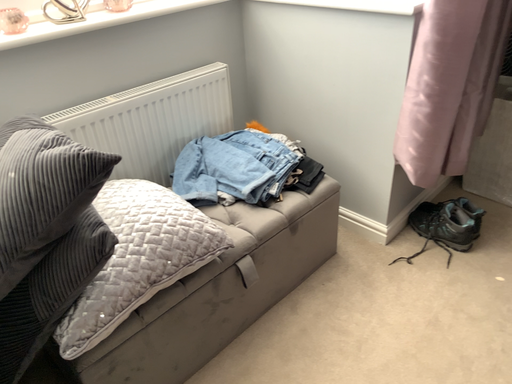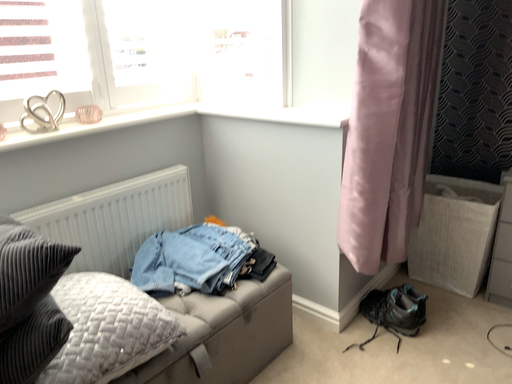
Question: Which way did the camera rotate in the video?

Choices:
 (A) rotated upward
 (B) rotated downward

Answer: (A)